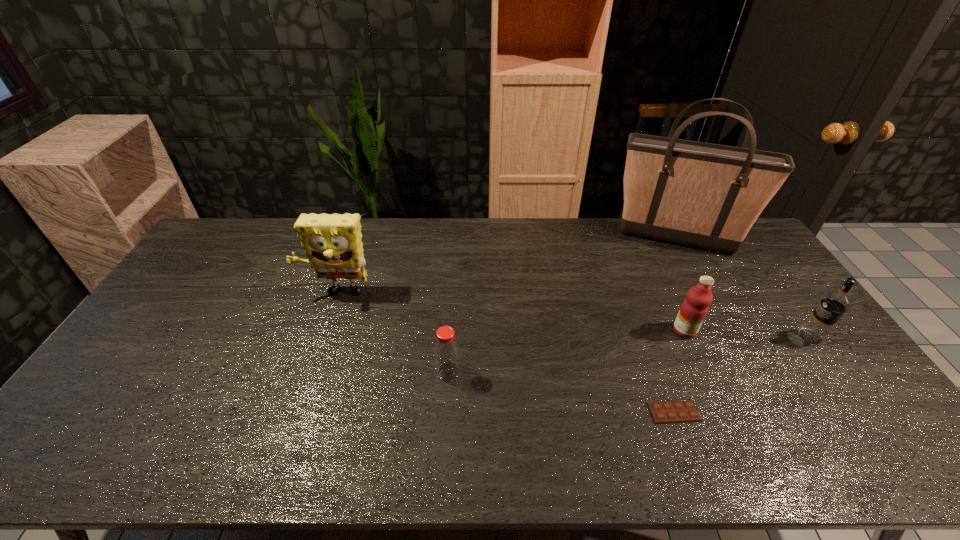
Identify the location of vacant region located 0.260m on the left of the farthest object. The height and width of the screenshot is (540, 960). [x=540, y=239].

Locate an element on the screen. free space located 0.250m on the face of the second tallest object is located at coordinates (310, 372).

Image resolution: width=960 pixels, height=540 pixels. Find the location of `free space located on the label of the vodka`. free space located on the label of the vodka is located at coordinates (761, 336).

This screenshot has height=540, width=960. I want to click on blank space located 0.400m on the label of the vodka, so click(662, 336).

Locate an element on the screen. The image size is (960, 540). vacant space located on the label of the vodka is located at coordinates (665, 336).

Identify the location of free space located 0.320m on the label of the fruit juice. (735, 443).

Where is `vacant space located on the left of the second shortest object`? The width and height of the screenshot is (960, 540). vacant space located on the left of the second shortest object is located at coordinates (373, 372).

You are a GUI agent. You are given a task and a screenshot of the screen. Output one action in this format:
    pyautogui.click(x=<x>, y=<y>)
    Task: Click on the vacant space located 0.330m on the back of the shortest object
    Image resolution: width=960 pixels, height=540 pixels.
    Given the screenshot: What is the action you would take?
    click(x=636, y=308)

Identify the location of object that is positioned at the far edge. (707, 196).

Identify the location of shopping bag that is at the right edge. The width and height of the screenshot is (960, 540). (707, 196).